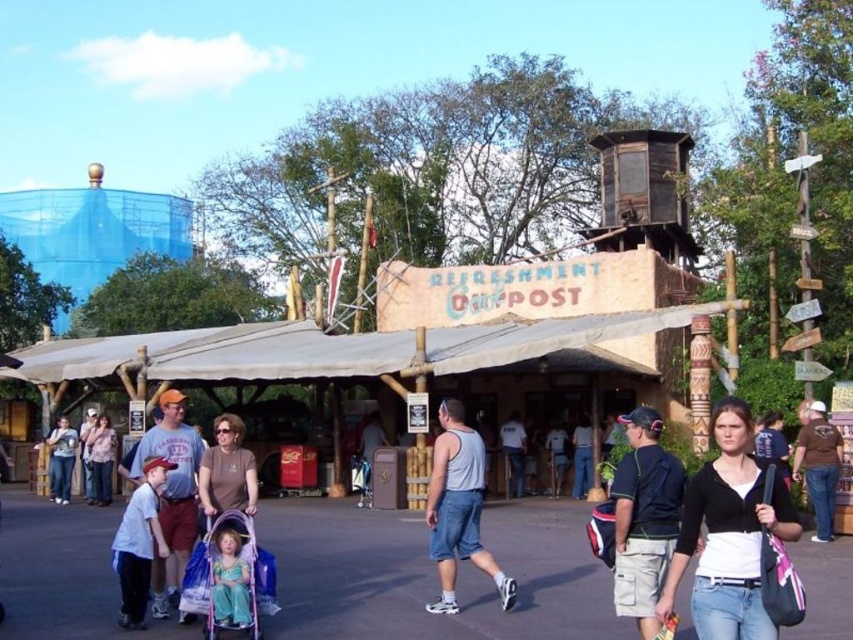
Question: Is purple fabric stroller at center thinner than light blue denim shorts at center?

Choices:
 (A) no
 (B) yes

Answer: (A)

Question: Based on their relative distances, which object is farther from the matte gray shirt at center?

Choices:
 (A) turquoise fabric dress at lower center
 (B) light blue denim shorts at center
 (C) matte gray shirt at left
 (D) brown cotton shirt at center-right

Answer: (D)

Question: Which point is farther to the camera?

Choices:
 (A) black cotton shirt at lower right
 (B) light blue denim shorts at center
 (C) purple fabric stroller at center

Answer: (B)

Question: Where is brown cotton shirt at center-right located in relation to light blue denim shorts at center in the image?

Choices:
 (A) left
 (B) right

Answer: (B)

Question: Which object is positioned closest to the white cotton shirt at center?

Choices:
 (A) light blue denim shorts at center
 (B) turquoise fabric dress at lower center
 (C) light blue t-shirt at center
 (D) purple fabric stroller at center

Answer: (C)

Question: Is purple fabric stroller at center in front of light blue t-shirt at center?

Choices:
 (A) no
 (B) yes

Answer: (B)